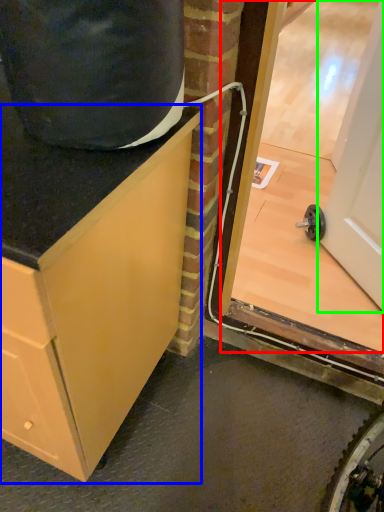
Question: Estimate the real-world distances between objects in this image. Which object is closer to glass door (highlighted by a red box), cabinetry (highlighted by a blue box) or door (highlighted by a green box)?

Choices:
 (A) cabinetry
 (B) door

Answer: (B)